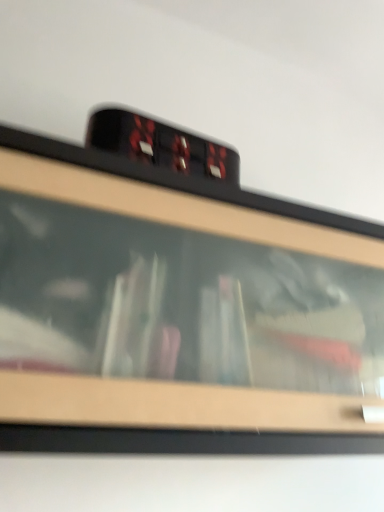
This screenshot has height=512, width=384. What do you see at coordinates (177, 312) in the screenshot?
I see `black plastic clock at upper center` at bounding box center [177, 312].

In order to face black plastic clock at upper center, should I rotate leftwards or rightwards?

Rotate right and turn 6.198 degrees.

Identify the location of black plastic clock at upper center. This screenshot has width=384, height=512. (177, 312).

Find the location of a particular element. black plastic clock at upper center is located at coordinates (177, 312).